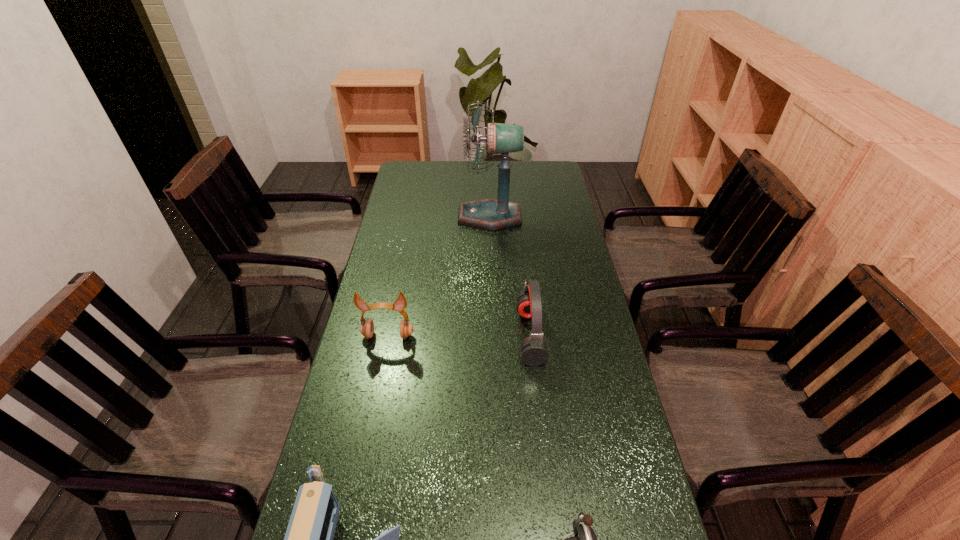
Image resolution: width=960 pixels, height=540 pixels. I want to click on the tallest object, so click(x=491, y=214).

Locate an element on the screen. the farthest object is located at coordinates (491, 214).

Find the location of a particular element. The image size is (960, 540). the leftmost earphone is located at coordinates (367, 326).

Locate an element on the screen. The width and height of the screenshot is (960, 540). free space located in front of the farthest object where the wind blows is located at coordinates (395, 217).

What are the coordinates of `free region located in front of the farthest object where the wind blows` in the screenshot? It's located at (420, 217).

Where is `vacant space located 0.060m in front of the farthest object where the wind blows`? The image size is (960, 540). vacant space located 0.060m in front of the farthest object where the wind blows is located at coordinates (443, 217).

Identify the location of free space located 0.200m on the front-facing side of the leftmost earphone. This screenshot has height=540, width=960. (374, 406).

Identify the location of object that is at the left edge. The width and height of the screenshot is (960, 540). (367, 326).

The height and width of the screenshot is (540, 960). I want to click on vacant point at the far edge, so click(x=468, y=171).

You are a GUI agent. You are given a task and a screenshot of the screen. Output one action in this format:
    pyautogui.click(x=<x>, y=<y>)
    Task: Click on the free space at the left edge
    Image resolution: width=960 pixels, height=540 pixels.
    Given the screenshot: What is the action you would take?
    pyautogui.click(x=418, y=243)